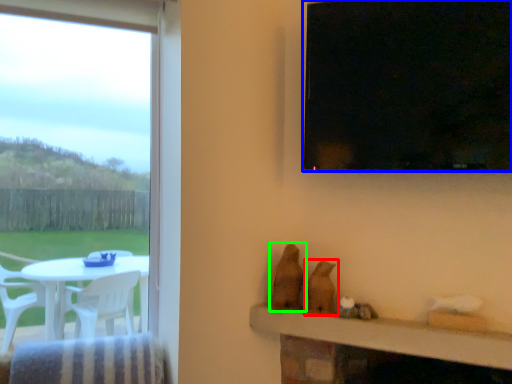
Question: Estimate the real-world distances between objects in this image. Which object is farther from animal (highlighted by a red box), window (highlighted by a blue box) or animal (highlighted by a green box)?

Choices:
 (A) window
 (B) animal

Answer: (A)